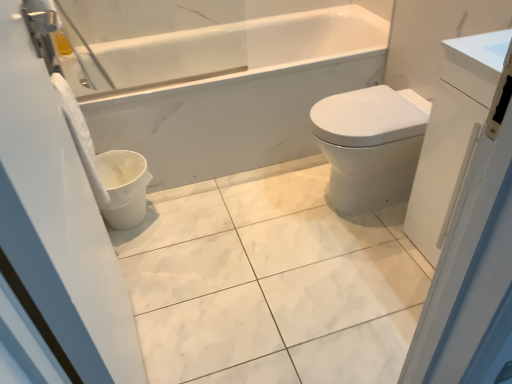
At what (x,y) coordinates should I click in order to perform the action: click on free space that is to the left of white glossy cabinet at right, the 1th screen door positioned from the right. Please return your answer as a coordinate pair (x, y). The height and width of the screenshot is (384, 512). Looking at the image, I should click on (374, 269).